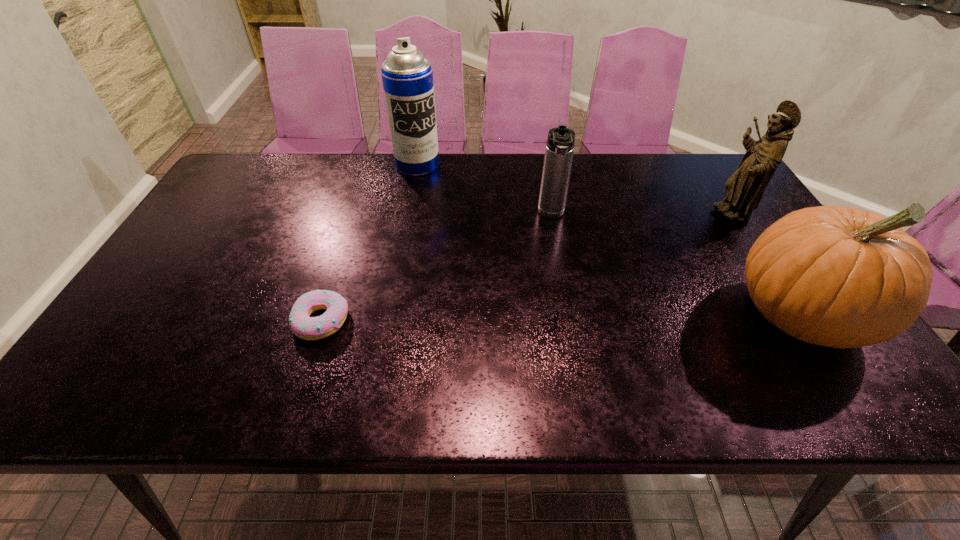
Identify the location of blank region between the tallest object and the shortest object. (370, 242).

Locate an element on the screen. The image size is (960, 540). free space between the pumpkin and the thermos bottle is located at coordinates (676, 265).

Where is `free spot between the pumpkin and the thermos bottle`? The height and width of the screenshot is (540, 960). free spot between the pumpkin and the thermos bottle is located at coordinates (676, 265).

Find the location of a particular element. The height and width of the screenshot is (540, 960). empty space between the pumpkin and the thermos bottle is located at coordinates (676, 265).

Identify the location of empty space between the aerosol can and the third object from right to left. The width and height of the screenshot is (960, 540). (485, 190).

Where is `vacant point located between the leftmost object and the pumpkin`? vacant point located between the leftmost object and the pumpkin is located at coordinates (561, 318).

Where is `free space between the pumpkin and the farthest object`? The height and width of the screenshot is (540, 960). free space between the pumpkin and the farthest object is located at coordinates (609, 240).

Find the location of a particular element. The image size is (960, 540). vacant space that's between the pumpkin and the leftmost object is located at coordinates (561, 318).

The image size is (960, 540). In order to click on object that is the fourth closest to the aerosol can in this screenshot , I will do `click(842, 277)`.

Find the location of `object that ranks as the second closest to the figurine`. object that ranks as the second closest to the figurine is located at coordinates (560, 143).